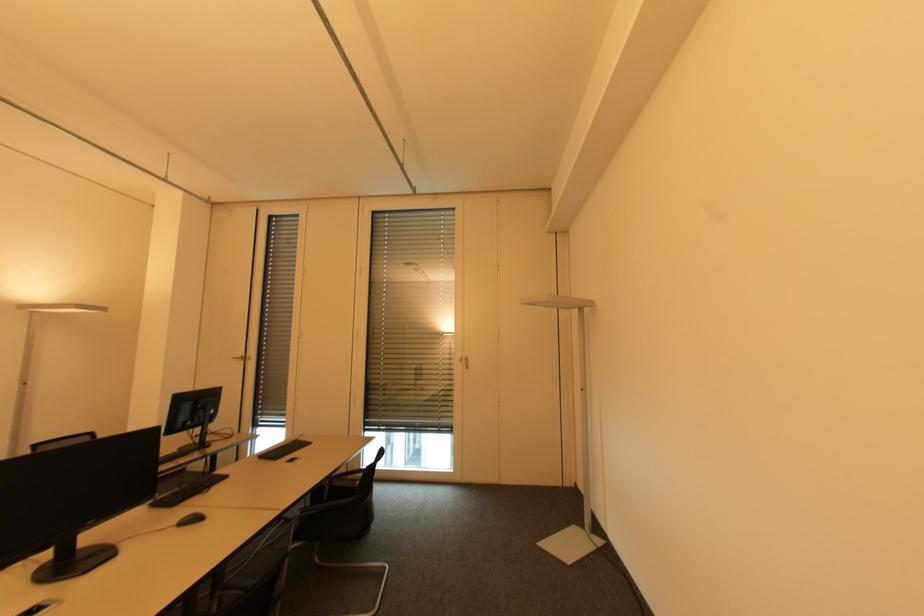
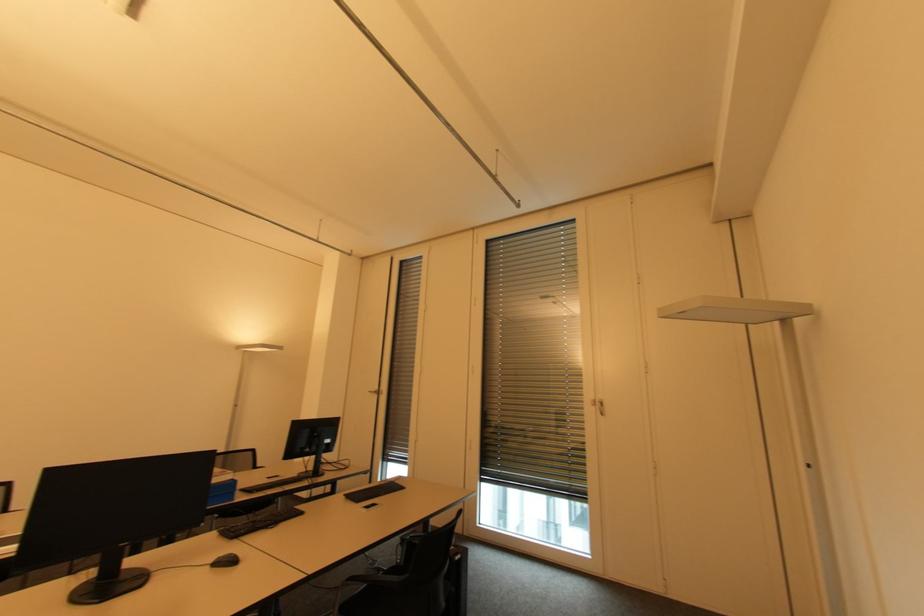
Find the pixel in the second image that matches (468,369) in the first image.

(603, 416)